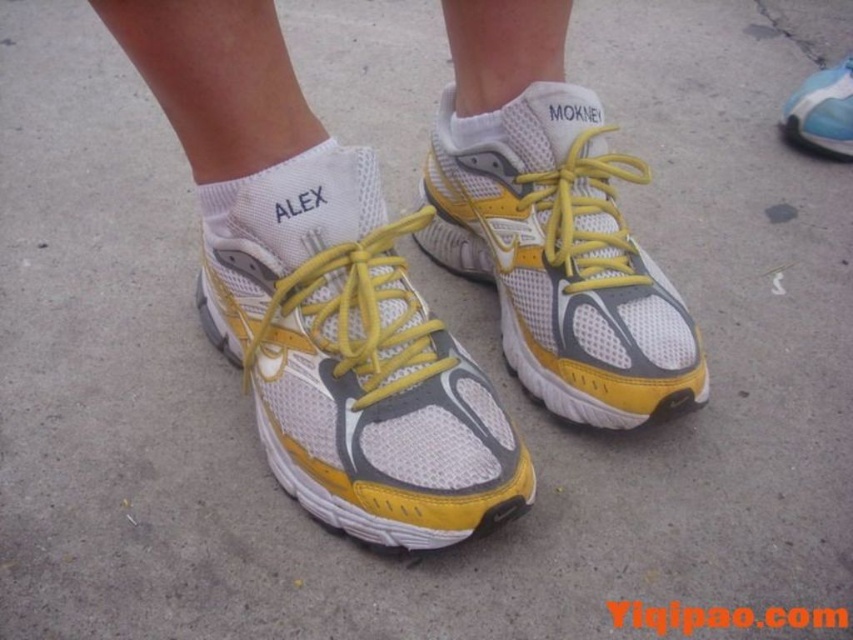
Question: Among these objects, which one is nearest to the camera?

Choices:
 (A) white fabric sock at center
 (B) yellow mesh shoe at center
 (C) yellow mesh running shoe at center

Answer: (C)

Question: Considering the real-world distances, which object is closest to the white fabric sock at center?

Choices:
 (A) yellow mesh shoe at upper right
 (B) yellow mesh running shoe at center
 (C) yellow mesh shoe at center

Answer: (B)

Question: From the image, what is the correct spatial relationship of yellow mesh running shoe at center in relation to yellow mesh shoe at center?

Choices:
 (A) below
 (B) above

Answer: (A)

Question: Does yellow mesh running shoe at center have a greater width compared to white fabric sock at center?

Choices:
 (A) no
 (B) yes

Answer: (B)

Question: Which point is closer to the camera?

Choices:
 (A) (251, 198)
 (B) (566, 369)

Answer: (A)

Question: Does yellow mesh running shoe at center appear on the right side of white fabric sock at center?

Choices:
 (A) yes
 (B) no

Answer: (A)